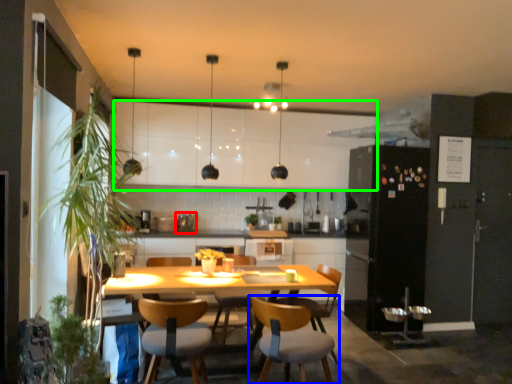
Question: Which is farther away from appliance (highlighted by a red box)? chair (highlighted by a blue box) or cabinetry (highlighted by a green box)?

Choices:
 (A) chair
 (B) cabinetry

Answer: (A)